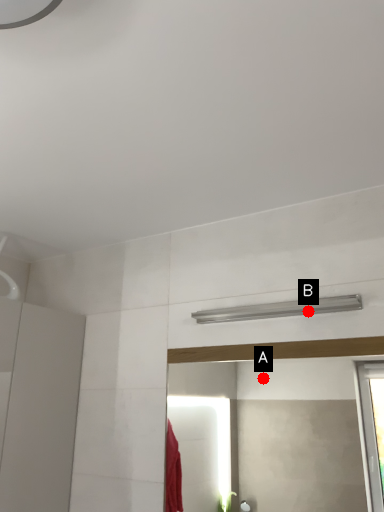
Question: Two points are circled on the image, labeled by A and B beside each circle. Among these points, which one is nearest to the camera?

Choices:
 (A) A is closer
 (B) B is closer

Answer: (B)